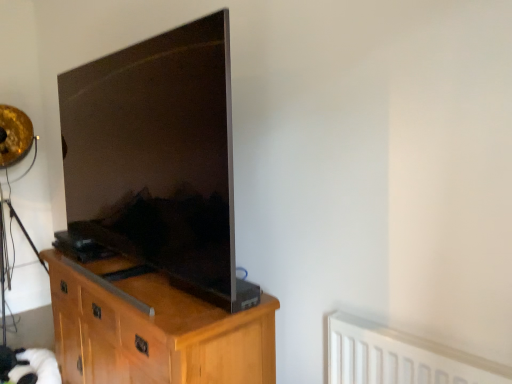
Identify the location of vacant point above white plastic radiator at lower right (from a real-world perspective). (413, 339).